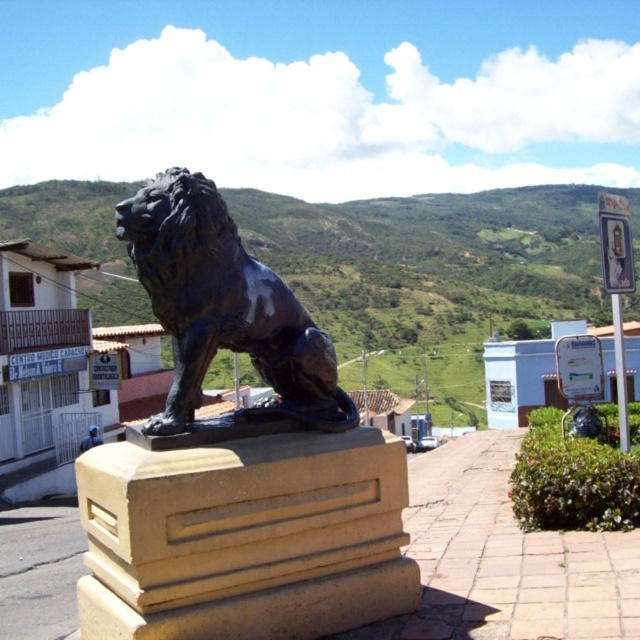
Between black polished stone lion at center and shiny black lion at center, which one is positioned lower?

black polished stone lion at center is below.

Who is more forward, (236, 595) or (177, 266)?

Point (236, 595) is in front.

What do you see at coordinates (237, 460) in the screenshot? I see `black polished stone lion at center` at bounding box center [237, 460].

The image size is (640, 640). What are the coordinates of `black polished stone lion at center` in the screenshot? It's located at (237, 460).

Is point (312, 541) closer to viewer compared to point (268, 316)?

Yes, point (312, 541) is in front of point (268, 316).

Who is shorter, beige stone pedestal at center or shiny black lion at center?

beige stone pedestal at center

What are the coordinates of `beige stone pedestal at center` in the screenshot? It's located at (244, 538).

Is black polished stone lion at center wider than beige stone pedestal at center?

Correct, the width of black polished stone lion at center exceeds that of beige stone pedestal at center.

Between point (193, 218) and point (348, 512), which one is positioned behind?

Point (348, 512)

Which is behind, point (268, 518) or point (230, 484)?

Point (268, 518)

Locate an element on the screen. black polished stone lion at center is located at coordinates (237, 460).